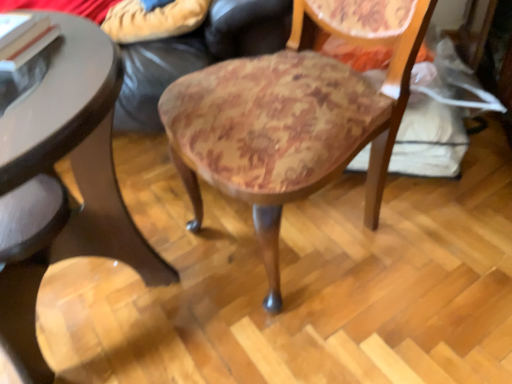
Question: Based on their sizes in the image, would you say wooden round table at lower left is bigger or smaller than leather couch at center?

Choices:
 (A) big
 (B) small

Answer: (B)

Question: Is wooden round table at lower left situated inside leather couch at center or outside?

Choices:
 (A) outside
 (B) inside

Answer: (A)

Question: Considering the real-world distances, which object is closest to the wooden upholstered chair at center?

Choices:
 (A) wooden round table at lower left
 (B) leather couch at center

Answer: (B)

Question: Which object is the closest to the leather couch at center?

Choices:
 (A) wooden round table at lower left
 (B) wooden upholstered chair at center

Answer: (B)